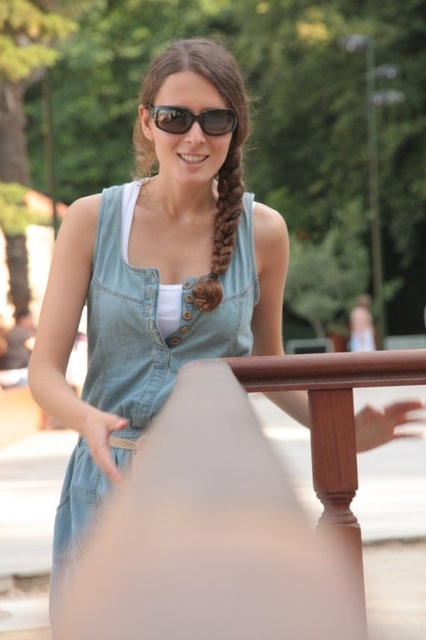
You are a photographer adjusting your camera settings to focus on the person in the center of the image. The camera can only focus precisely on objects at the exact coordinates provided. Is the point at coordinates point (155, 321) the location of the denim dress at center?

Yes, the point (155, 321) corresponds to the denim dress at center, so the camera can focus precisely on it there.